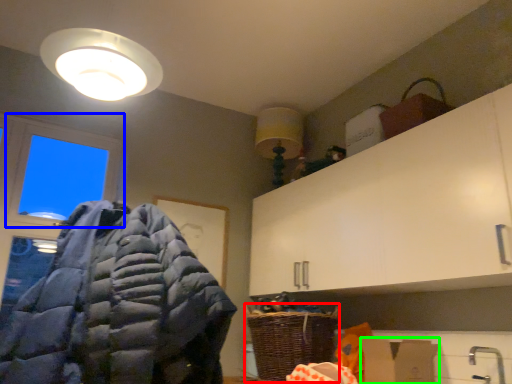
Question: Based on their relative distances, which object is farther from basket (highlighted by a red box)? Choose from window (highlighted by a blue box) and cardboard box (highlighted by a green box).

Choices:
 (A) window
 (B) cardboard box

Answer: (A)